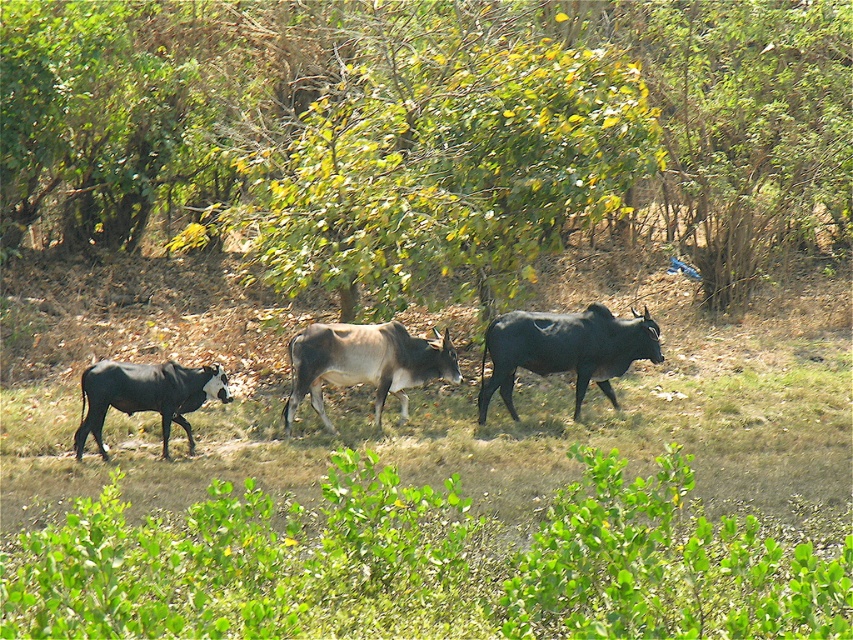
You are a photographer aiming to capture a photo of the brown glossy cow at center and the black glossy cow at left. Based on their positions, which cow appears closer to the camera?

The brown glossy cow at center appears closer to the camera because it is located above the black glossy cow at left, which typically indicates a higher position in the image frame.

You are a farmer who wants to identify the larger cow between the shiny black cow at center and the brown glossy cow at center. Which one is bigger?

The shiny black cow at center is bigger than the brown glossy cow at center.

Looking at this image, in the image of the serene rural scene with three cows grazing, where exactly is the shiny black cow at center located in terms of coordinates?

The shiny black cow at center is located at coordinates point [564,349].